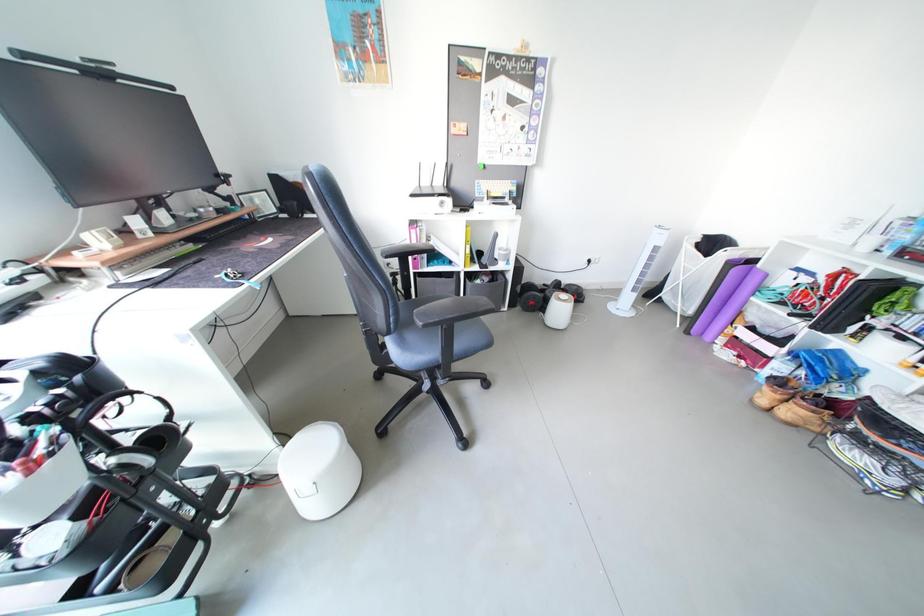
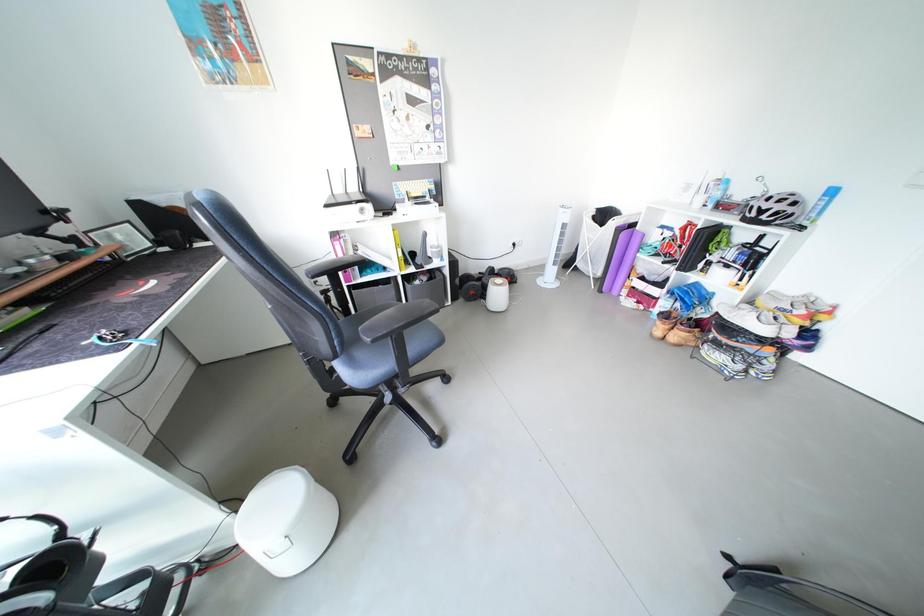
Question: In a continuous first-person perspective shot, in which direction is the camera moving?

Choices:
 (A) Left
 (B) Right
 (C) Forward
 (D) Backward

Answer: (D)